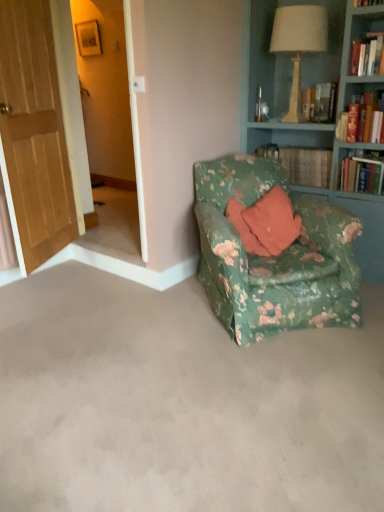
Question: From the image's perspective, is wooden screen door at left above or below green floral fabric chair at lower right?

Choices:
 (A) below
 (B) above

Answer: (B)

Question: Is wooden screen door at left inside or outside of green floral fabric chair at lower right?

Choices:
 (A) inside
 (B) outside

Answer: (B)

Question: Which of these objects is positioned closest to the floral fabric armchair at center?

Choices:
 (A) wooden screen door at left
 (B) green floral fabric chair at lower right
 (C) matte beige lampshade at upper right
 (D) hardcover book at upper right, which is the 1th book in front-to-back order
 (E) wooden door at left

Answer: (B)

Question: Estimate the real-world distances between objects in this image. Which object is closer to the matte beige lampshade at upper right?

Choices:
 (A) wooden door at left
 (B) floral fabric armchair at center
 (C) hardcover book at upper right, which is the 1th book in front-to-back order
 (D) wooden screen door at left
 (E) floral fabric cushion at center, which is counted as the 1th book, starting from the back

Answer: (C)